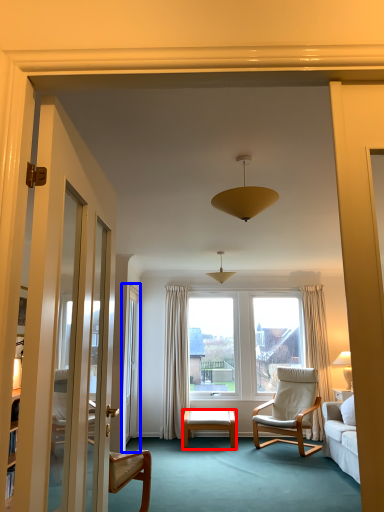
Question: Which point is closer to the camera, desk (highlighted by a red box) or screen door (highlighted by a blue box)?

Choices:
 (A) desk
 (B) screen door

Answer: (B)